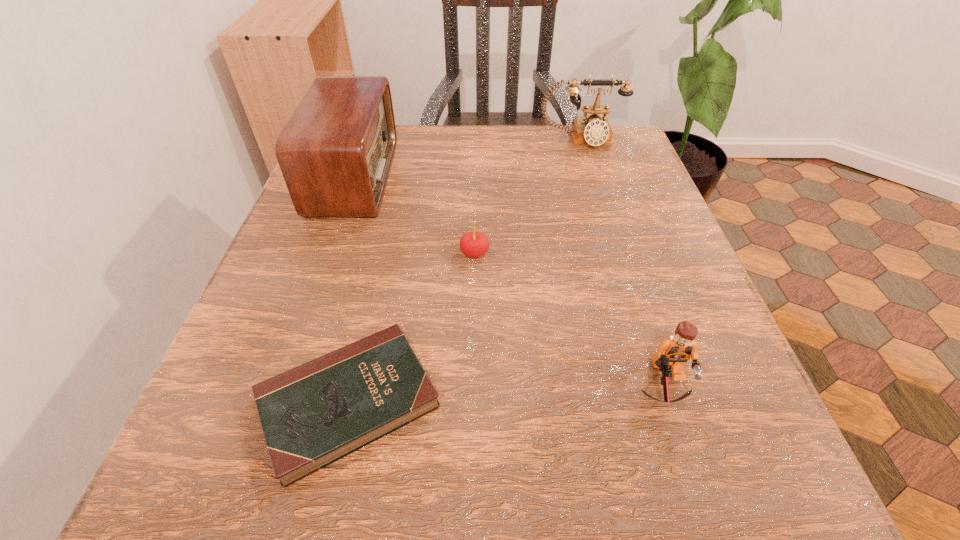
The image size is (960, 540). In order to click on radio receiver in this screenshot , I will do `click(335, 152)`.

This screenshot has width=960, height=540. What are the coordinates of `telephone` in the screenshot? It's located at (594, 130).

Where is `Lego`? Image resolution: width=960 pixels, height=540 pixels. Lego is located at coordinates (673, 353).

Identify the location of the third object from left to right. (473, 244).

Locate an element on the screen. cherry is located at coordinates (473, 244).

You are a GUI agent. You are given a task and a screenshot of the screen. Output one action in this format:
    pyautogui.click(x=<x>, y=<y>)
    Task: Click on the shortest object
    
    Given the screenshot: What is the action you would take?
    pyautogui.click(x=313, y=415)

The image size is (960, 540). I want to click on vacant area situated on the front panel of the radio receiver, so click(x=464, y=177).

Locate an element on the screen. The height and width of the screenshot is (540, 960). vacant space located 0.260m on the dial number of the telephone is located at coordinates (608, 222).

This screenshot has width=960, height=540. I want to click on vacant space situated holding a crossbow in the hands of the Lego, so click(x=689, y=461).

Locate an element on the screen. free region located 0.170m on the back of the cherry is located at coordinates (475, 190).